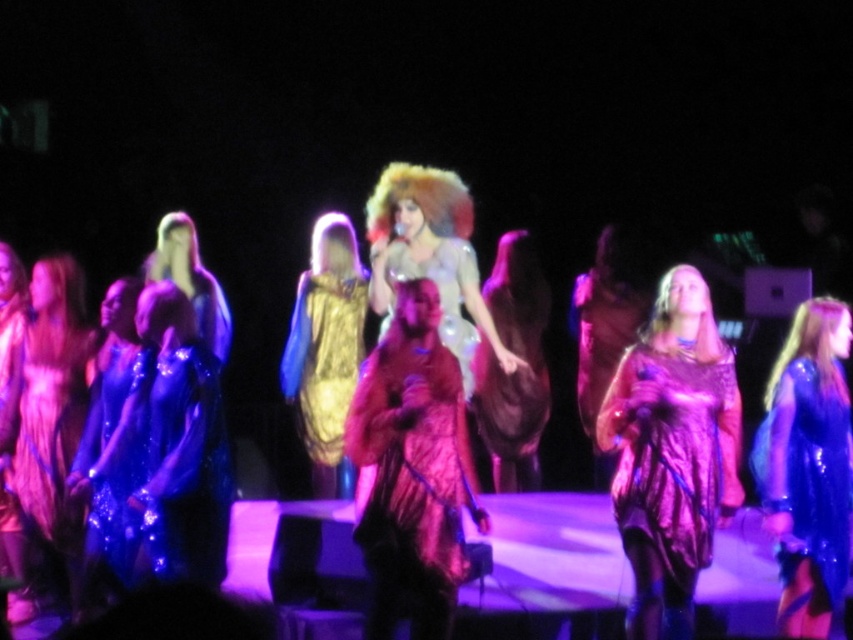
Question: Can you confirm if metallic purple dress at center is positioned to the right of gold sequined dress at center?

Choices:
 (A) no
 (B) yes

Answer: (B)

Question: Is fuzzy pink fur coat at center below shiny blue wig at upper right?

Choices:
 (A) no
 (B) yes

Answer: (B)

Question: Which object is the closest to the shiny blue dress at right?

Choices:
 (A) shiny brown dress at center
 (B) fuzzy pink fur coat at center

Answer: (B)

Question: Which point is closer to the camera?

Choices:
 (A) (795, 632)
 (B) (683, 534)
 (C) (45, 282)
 (D) (814, 304)

Answer: (B)

Question: Is shiny blue dress at right to the left of shiny blue wig at upper right from the viewer's perspective?

Choices:
 (A) yes
 (B) no

Answer: (A)

Question: Based on their relative distances, which object is farther from the shiny blue dress at right?

Choices:
 (A) shiny brown dress at center
 (B) fuzzy golden wig at center

Answer: (A)